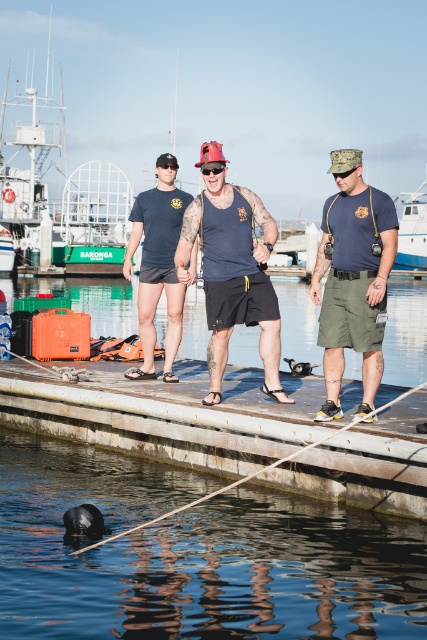
Question: Is green painted steel boat at upper left smaller than matte olive green shorts at center?

Choices:
 (A) yes
 (B) no

Answer: (B)

Question: Is the position of red reflective plastic goggles at center more distant than that of black matte goggles at center?

Choices:
 (A) yes
 (B) no

Answer: (B)

Question: Which point is farther from the camera taking this photo?

Choices:
 (A) (350, 224)
 (B) (184, 214)
 (C) (146, 276)

Answer: (C)

Question: Which point is farther to the camera?

Choices:
 (A) (263, 305)
 (B) (221, 163)
 (C) (254, 492)

Answer: (A)

Question: Among these objects, which one is nearest to the camera?

Choices:
 (A) matte blue tank top at center
 (B) green painted steel boat at upper left
 (C) white plastic boat at center
 (D) wooden at center

Answer: (D)

Question: Is matte olive green shorts at center above matte black shorts at center?

Choices:
 (A) yes
 (B) no

Answer: (B)